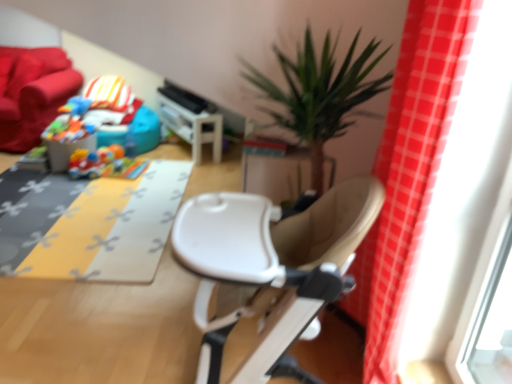
Question: Should I look upward or downward to see plastic colorful car at center, arranged as the 2th toy when viewed from the left?

Choices:
 (A) down
 (B) up

Answer: (B)

Question: Is plastic colorful car at center, marked as the second toy in a top-to-bottom arrangement, looking in the opposite direction of velvet red couch at upper left?

Choices:
 (A) yes
 (B) no

Answer: (B)

Question: Does plastic colorful car at center, arranged as the 2th toy when viewed from the left, have a lesser height compared to velvet red couch at upper left?

Choices:
 (A) yes
 (B) no

Answer: (A)

Question: Does plastic colorful car at center, marked as the first toy in a bottom-to-top arrangement, have a lesser width compared to velvet red couch at upper left?

Choices:
 (A) yes
 (B) no

Answer: (A)

Question: Does plastic colorful car at center, marked as the second toy in a top-to-bottom arrangement, have a greater width compared to velvet red couch at upper left?

Choices:
 (A) yes
 (B) no

Answer: (B)

Question: Does plastic colorful car at center, marked as the second toy in a top-to-bottom arrangement, come in front of velvet red couch at upper left?

Choices:
 (A) no
 (B) yes

Answer: (B)

Question: From a real-world perspective, is plastic colorful car at center, arranged as the 2th toy when viewed from the left, on top of velvet red couch at upper left?

Choices:
 (A) yes
 (B) no

Answer: (B)

Question: Does white plastic chair at center lie in front of rubberized blue toy at upper left, the 2th toy from the bottom?

Choices:
 (A) no
 (B) yes

Answer: (B)

Question: Are white plastic chair at center and rubberized blue toy at upper left, positioned as the 1th toy in top-to-bottom order, far apart?

Choices:
 (A) no
 (B) yes

Answer: (B)

Question: Is rubberized blue toy at upper left, marked as the 1th toy in a left-to-right arrangement, a part of white plastic chair at center?

Choices:
 (A) yes
 (B) no

Answer: (B)

Question: Does white plastic chair at center have a smaller size compared to rubberized blue toy at upper left, positioned as the 1th toy in top-to-bottom order?

Choices:
 (A) yes
 (B) no

Answer: (B)

Question: Considering the relative sizes of white plastic chair at center and rubberized blue toy at upper left, positioned as the 1th toy in top-to-bottom order, in the image provided, is white plastic chair at center thinner than rubberized blue toy at upper left, positioned as the 1th toy in top-to-bottom order,?

Choices:
 (A) no
 (B) yes

Answer: (A)

Question: Is white plastic chair at center not within rubberized blue toy at upper left, the 2th toy from the bottom?

Choices:
 (A) no
 (B) yes

Answer: (B)

Question: Considering the relative sizes of yellow fabric mat at center and plastic colorful car at center, arranged as the 2th toy when viewed from the left, in the image provided, is yellow fabric mat at center thinner than plastic colorful car at center, arranged as the 2th toy when viewed from the left,?

Choices:
 (A) no
 (B) yes

Answer: (A)